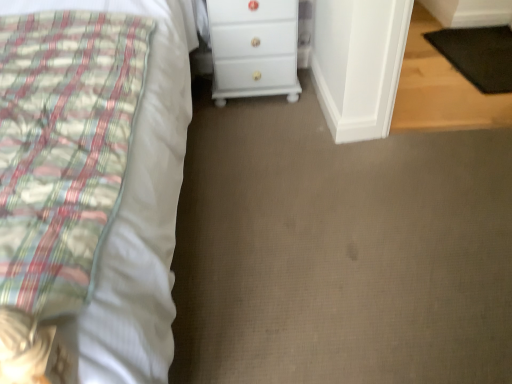
Question: From their relative heights in the image, would you say white glossy chest of drawers at center is taller or shorter than white cotton bed at left?

Choices:
 (A) tall
 (B) short

Answer: (B)

Question: From a real-world perspective, is white glossy chest of drawers at center physically located above or below white cotton bed at left?

Choices:
 (A) below
 (B) above

Answer: (A)

Question: Estimate the real-world distances between objects in this image. Which object is closer to the white cotton bed at left?

Choices:
 (A) white glossy chest of drawers at center
 (B) black rubber mat at lower right

Answer: (A)

Question: Which object is the farthest from the black rubber mat at lower right?

Choices:
 (A) white cotton bed at left
 (B) white glossy chest of drawers at center

Answer: (A)